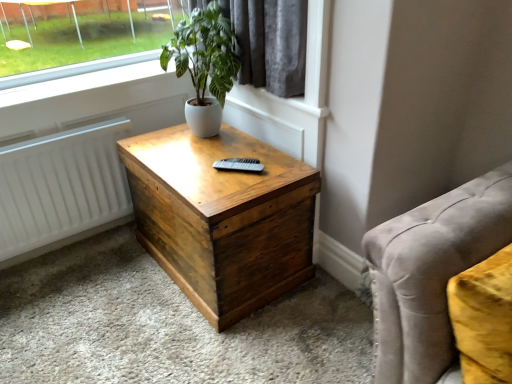
You are a GUI agent. You are given a task and a screenshot of the screen. Output one action in this format:
    pyautogui.click(x=<x>, y=<y>)
    Task: Click on the green leafy plant at upper center
    The height and width of the screenshot is (384, 512).
    Given the screenshot: What is the action you would take?
    pyautogui.click(x=204, y=65)

This screenshot has height=384, width=512. What do you see at coordinates (222, 218) in the screenshot?
I see `wooden nightstand at center` at bounding box center [222, 218].

Locate an element on the screen. This screenshot has height=384, width=512. velvet gray studio couch at lower right is located at coordinates (431, 274).

This screenshot has width=512, height=384. I want to click on green leafy plant at upper center, so click(x=204, y=65).

Can you tell me how much white matte radiator at left and wooden nightstand at center differ in facing direction?

The facing directions of white matte radiator at left and wooden nightstand at center are 89.9 degrees apart.

Looking at this image, which is more to the left, white matte radiator at left or wooden nightstand at center?

white matte radiator at left.

I want to click on radiator lying above the wooden nightstand at center (from the image's perspective), so click(x=61, y=189).

Between white matte radiator at left and wooden nightstand at center, which one has smaller width?

white matte radiator at left.

Based on the photo, would you consider green leafy plant at upper center to be distant from white matte radiator at left?

No, green leafy plant at upper center is not far away from white matte radiator at left.

Is green leafy plant at upper center in front of or behind white matte radiator at left in the image?

green leafy plant at upper center is positioned closer to the viewer than white matte radiator at left.

From the image's perspective, is green leafy plant at upper center beneath white matte radiator at left?

Actually, green leafy plant at upper center appears above white matte radiator at left in the image.

In terms of width, does green leafy plant at upper center look wider or thinner when compared to white matte radiator at left?

Clearly, green leafy plant at upper center has more width compared to white matte radiator at left.

Considering the relative sizes of white matte radiator at left and green leafy plant at upper center in the image provided, is white matte radiator at left shorter than green leafy plant at upper center?

Yes, white matte radiator at left is shorter than green leafy plant at upper center.

Is the surface of white matte radiator at left in direct contact with green leafy plant at upper center?

white matte radiator at left and green leafy plant at upper center are not in contact.

The width and height of the screenshot is (512, 384). In order to click on radiator that is on the left side of green leafy plant at upper center in this screenshot , I will do `click(61, 189)`.

Which point is more distant from viewer, (99,174) or (184,35)?

The point (99,174) is behind.

Choose the correct answer: Is white matte radiator at left inside velvet gray studio couch at lower right or outside it?

white matte radiator at left exists outside the volume of velvet gray studio couch at lower right.

Considering the relative sizes of white matte radiator at left and velvet gray studio couch at lower right in the image provided, is white matte radiator at left wider than velvet gray studio couch at lower right?

No, white matte radiator at left is not wider than velvet gray studio couch at lower right.

How distant is white matte radiator at left from velvet gray studio couch at lower right?

white matte radiator at left and velvet gray studio couch at lower right are 1.57 meters apart from each other.

From a real-world perspective, is white matte radiator at left positioned above or below velvet gray studio couch at lower right?

Clearly, from a real-world perspective, white matte radiator at left is below velvet gray studio couch at lower right.

From a real-world perspective, which object rests below the other?

wooden nightstand at center.

Is green leafy plant at upper center aimed at wooden nightstand at center?

No, green leafy plant at upper center is not turned towards wooden nightstand at center.

Is green leafy plant at upper center closer to the viewer compared to wooden nightstand at center?

No, the depth of green leafy plant at upper center is greater than that of wooden nightstand at center.

Could green leafy plant at upper center be considered to be inside velvet gray studio couch at lower right?

No, green leafy plant at upper center is not a part of velvet gray studio couch at lower right.

Does velvet gray studio couch at lower right have a larger size compared to green leafy plant at upper center?

Correct, velvet gray studio couch at lower right is larger in size than green leafy plant at upper center.

Considering the positions of points (380, 231) and (185, 39), is point (380, 231) farther from camera compared to point (185, 39)?

No, it is not.

Is there a large distance between velvet gray studio couch at lower right and green leafy plant at upper center?

Yes.

Locate an element on the screen. nightstand on the left of velvet gray studio couch at lower right is located at coordinates (222, 218).

Is wooden nightstand at center further to camera compared to velvet gray studio couch at lower right?

Yes, it is behind velvet gray studio couch at lower right.

Consider the image. What's the angular difference between wooden nightstand at center and velvet gray studio couch at lower right's facing directions?

The angle between the facing direction of wooden nightstand at center and the facing direction of velvet gray studio couch at lower right is 85.3 degrees.

Locate an element on the screen. nightstand that is under the white matte radiator at left (from a real-world perspective) is located at coordinates (222, 218).

This screenshot has height=384, width=512. What are the coordinates of `radiator behind the green leafy plant at upper center` in the screenshot? It's located at (61, 189).

Which object lies nearer to the anchor point green leafy plant at upper center, white matte radiator at left or wooden nightstand at center?

wooden nightstand at center lies closer to green leafy plant at upper center than the other object.

Considering their positions, is white matte radiator at left positioned closer to velvet gray studio couch at lower right than green leafy plant at upper center?

green leafy plant at upper center lies closer to velvet gray studio couch at lower right than the other object.

Looking at the image, which one is located closer to wooden nightstand at center, white matte radiator at left or velvet gray studio couch at lower right?

white matte radiator at left.

Looking at the image, which one is located closer to velvet gray studio couch at lower right, wooden nightstand at center or white matte radiator at left?

Based on the image, wooden nightstand at center appears to be nearer to velvet gray studio couch at lower right.

Considering their positions, is wooden nightstand at center positioned closer to green leafy plant at upper center than white matte radiator at left?

wooden nightstand at center is positioned closer to the anchor green leafy plant at upper center.

From the image, which object appears to be nearer to white matte radiator at left, wooden nightstand at center or green leafy plant at upper center?

The object closer to white matte radiator at left is wooden nightstand at center.

From the image, which object appears to be farther from wooden nightstand at center, green leafy plant at upper center or white matte radiator at left?

white matte radiator at left lies further to wooden nightstand at center than the other object.

Which object lies further to the anchor point velvet gray studio couch at lower right, wooden nightstand at center or green leafy plant at upper center?

green leafy plant at upper center lies further to velvet gray studio couch at lower right than the other object.

In order to click on nightstand situated between green leafy plant at upper center and velvet gray studio couch at lower right from left to right in this screenshot , I will do `click(222, 218)`.

This screenshot has width=512, height=384. Identify the location of houseplant between white matte radiator at left and velvet gray studio couch at lower right. (204, 65).

At what (x,y) coordinates should I click in order to perform the action: click on houseplant between white matte radiator at left and wooden nightstand at center. Please return your answer as a coordinate pair (x, y). The image size is (512, 384). Looking at the image, I should click on (204, 65).

This screenshot has width=512, height=384. What are the coordinates of `nightstand between white matte radiator at left and velvet gray studio couch at lower right in the horizontal direction` in the screenshot? It's located at (222, 218).